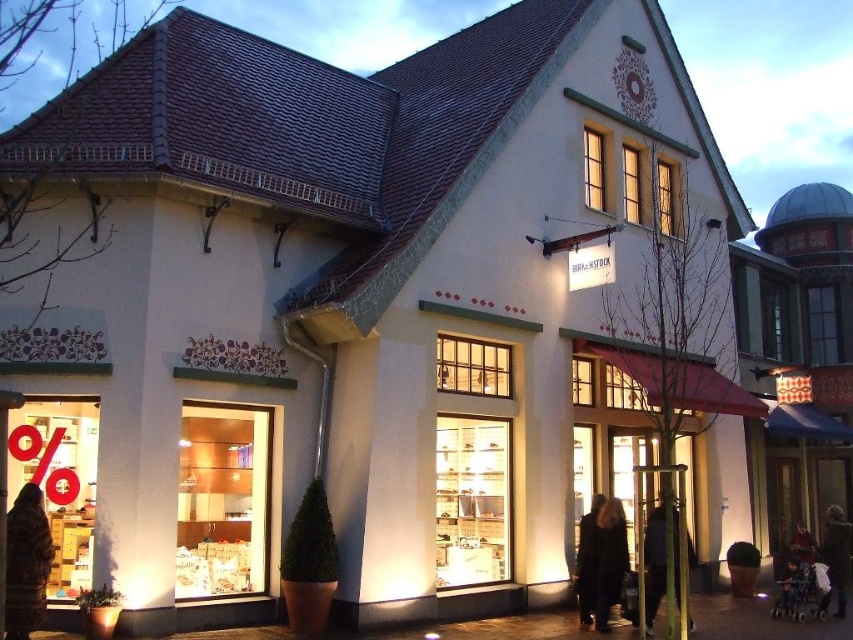
Does dark gray fabric coat at lower right have a greater height compared to dark brown leather jacket at lower right?

No, dark gray fabric coat at lower right is not taller than dark brown leather jacket at lower right.

Which is below, dark gray fabric coat at lower right or dark brown leather jacket at lower right?

dark brown leather jacket at lower right is below.

This screenshot has width=853, height=640. In order to click on dark gray fabric coat at lower right in this screenshot , I will do `click(608, 560)`.

Where is `dark gray fabric coat at lower right`? The height and width of the screenshot is (640, 853). dark gray fabric coat at lower right is located at coordinates (608, 560).

Is point (608, 544) closer to viewer compared to point (596, 540)?

Yes, it is.

Can you confirm if dark gray fabric coat at lower right is taller than dark brown leather coat at center?

In fact, dark gray fabric coat at lower right may be shorter than dark brown leather coat at center.

Is point (608, 509) positioned after point (589, 513)?

No.

Image resolution: width=853 pixels, height=640 pixels. Find the location of `dark gray fabric coat at lower right`. dark gray fabric coat at lower right is located at coordinates (608, 560).

Find the location of a particular element. This screenshot has height=640, width=853. dark gray fabric coat at center is located at coordinates (654, 563).

Measure the distance between dark gray fabric coat at center and camera.

The distance of dark gray fabric coat at center from camera is 138.06 feet.

You are a GUI agent. You are given a task and a screenshot of the screen. Output one action in this format:
    pyautogui.click(x=<x>, y=<y>)
    Task: Click on the dark gray fabric coat at center
    This screenshot has height=640, width=853.
    Given the screenshot: What is the action you would take?
    pyautogui.click(x=654, y=563)